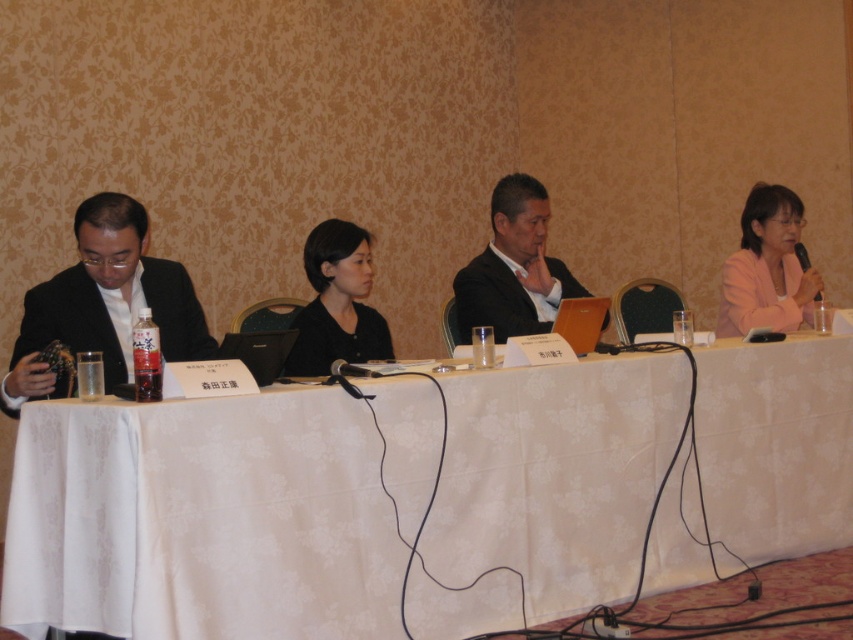
Based on the scene description, which object is positioned to the left of the other between the matte black suit at left and the pink fabric jacket at upper right?

The matte black suit at left is positioned to the left of the pink fabric jacket at upper right.

You are standing in front of the panel discussion table and want to place a small plant between the two points labeled point (120, 360) and point (743, 300). Which point should the plant be closer to if you want it to appear larger in the camera view?

The plant should be placed closer to point (120, 360) because it is closer to the camera, making objects placed there appear larger in the camera view.